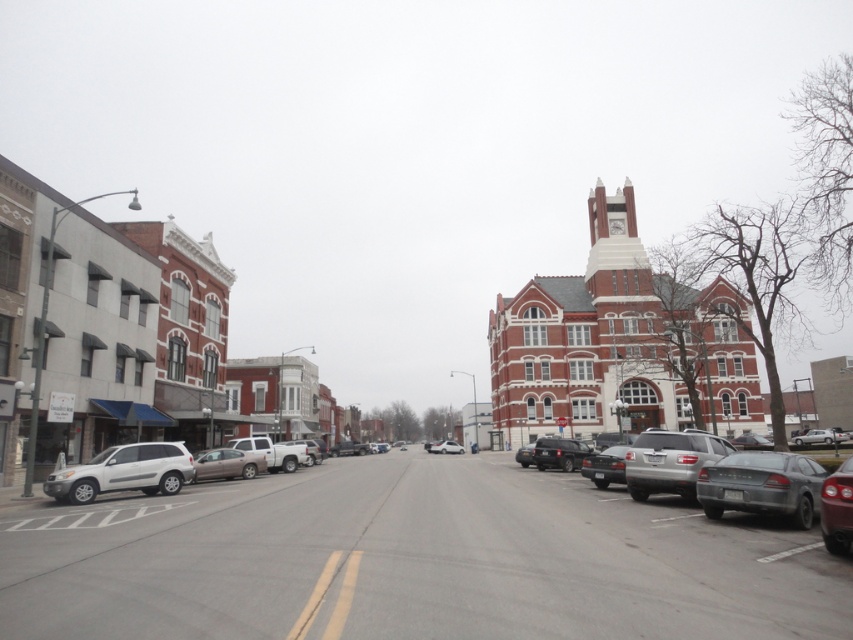
Based on the photo, between satin silver suv at lower left and silver metallic sedan at center-left, which one appears on the left side from the viewer's perspective?

satin silver suv at lower left

Does satin silver suv at lower left have a lesser height compared to silver metallic sedan at center-left?

No.

Between point (67, 474) and point (262, 464), which one is positioned behind?

The point (262, 464) is behind.

The width and height of the screenshot is (853, 640). Identify the location of satin silver suv at lower left. (125, 472).

Does silver metallic sedan at right have a lesser width compared to satin silver suv at lower left?

No, silver metallic sedan at right is not thinner than satin silver suv at lower left.

Does silver metallic sedan at right appear under satin silver suv at lower left?

Correct, silver metallic sedan at right is located below satin silver suv at lower left.

Where is `silver metallic sedan at right`? Image resolution: width=853 pixels, height=640 pixels. silver metallic sedan at right is located at coordinates (717, 476).

Who is more forward, (68, 493) or (672, 488)?

Point (672, 488) is in front.

Which of these two, satin silver suv at lower left or satin silver suv at lower right, stands taller?

satin silver suv at lower right is taller.

This screenshot has width=853, height=640. Describe the element at coordinates (125, 472) in the screenshot. I see `satin silver suv at lower left` at that location.

Where is `satin silver suv at lower left`? This screenshot has width=853, height=640. satin silver suv at lower left is located at coordinates (125, 472).